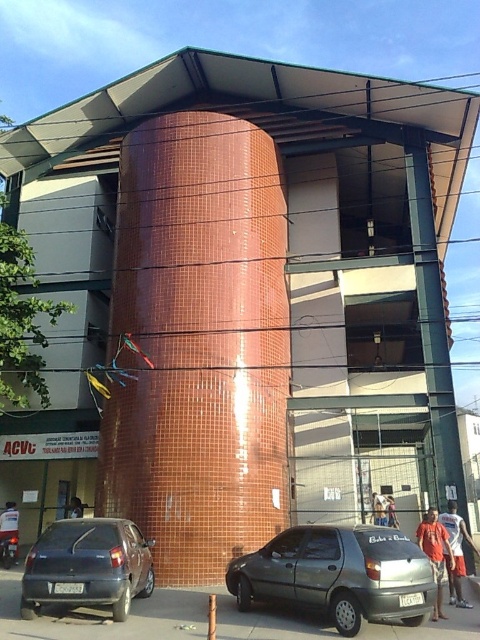
The height and width of the screenshot is (640, 480). Find the location of `metallic gray hatchback at lower center`. metallic gray hatchback at lower center is located at coordinates tap(338, 573).

Measure the distance from metallic gray hatchback at lower center to gray asphalt pavement at lower center.

2.55 meters

Which is in front, point (238, 604) or point (106, 620)?

Point (106, 620) is more forward.

Find the location of a particular element. This screenshot has height=640, width=480. metallic gray hatchback at lower center is located at coordinates click(338, 573).

Does gray asphalt pavement at lower center appear on the left side of matte gray car at lower left?

No, gray asphalt pavement at lower center is not to the left of matte gray car at lower left.

The height and width of the screenshot is (640, 480). I want to click on gray asphalt pavement at lower center, so click(157, 618).

Between point (357, 538) and point (34, 608), which one is positioned in front?

Point (357, 538)

Is point (357, 525) less distant than point (109, 580)?

No, (357, 525) is further to viewer.

The width and height of the screenshot is (480, 640). What are the coordinates of `metallic gray hatchback at lower center` in the screenshot? It's located at click(x=338, y=573).